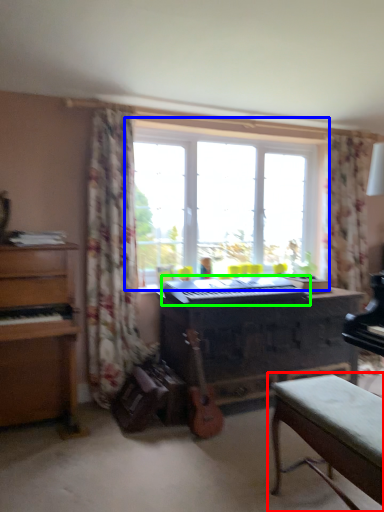
Question: Considering the real-world distances, which object is farthest from table (highlighted by a red box)? window (highlighted by a blue box) or musical keyboard (highlighted by a green box)?

Choices:
 (A) window
 (B) musical keyboard

Answer: (A)